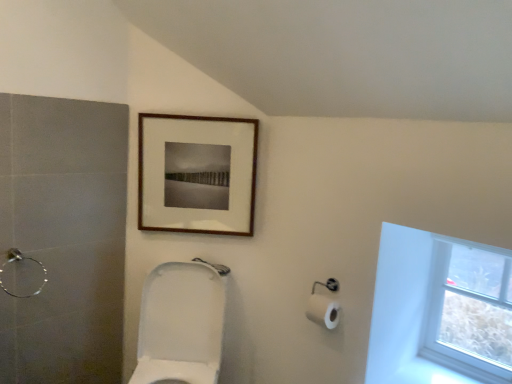
Question: Can you confirm if transparent glass window at upper right is thinner than wooden picture frame at upper center?

Choices:
 (A) yes
 (B) no

Answer: (B)

Question: From the image's perspective, is transparent glass window at upper right on top of wooden picture frame at upper center?

Choices:
 (A) no
 (B) yes

Answer: (A)

Question: Does transparent glass window at upper right have a greater width compared to wooden picture frame at upper center?

Choices:
 (A) yes
 (B) no

Answer: (A)

Question: Does transparent glass window at upper right turn towards wooden picture frame at upper center?

Choices:
 (A) yes
 (B) no

Answer: (B)

Question: Is transparent glass window at upper right completely or partially outside of wooden picture frame at upper center?

Choices:
 (A) no
 (B) yes

Answer: (B)

Question: Considering the relative sizes of transparent glass window at upper right and wooden picture frame at upper center in the image provided, is transparent glass window at upper right taller than wooden picture frame at upper center?

Choices:
 (A) no
 (B) yes

Answer: (B)

Question: Considering the relative sizes of white glossy toilet at center and transparent glass window at upper right in the image provided, is white glossy toilet at center wider than transparent glass window at upper right?

Choices:
 (A) no
 (B) yes

Answer: (B)

Question: Can you confirm if white glossy toilet at center is positioned to the right of transparent glass window at upper right?

Choices:
 (A) yes
 (B) no

Answer: (B)

Question: From the image's perspective, is white glossy toilet at center beneath transparent glass window at upper right?

Choices:
 (A) yes
 (B) no

Answer: (A)

Question: From a real-world perspective, is white glossy toilet at center beneath transparent glass window at upper right?

Choices:
 (A) yes
 (B) no

Answer: (A)

Question: Considering the relative sizes of white glossy toilet at center and transparent glass window at upper right in the image provided, is white glossy toilet at center thinner than transparent glass window at upper right?

Choices:
 (A) yes
 (B) no

Answer: (B)

Question: Does white glossy toilet at center appear on the left side of transparent glass window at upper right?

Choices:
 (A) no
 (B) yes

Answer: (B)

Question: Is wooden picture frame at upper center at the right side of brushed metal shower at left?

Choices:
 (A) yes
 (B) no

Answer: (A)